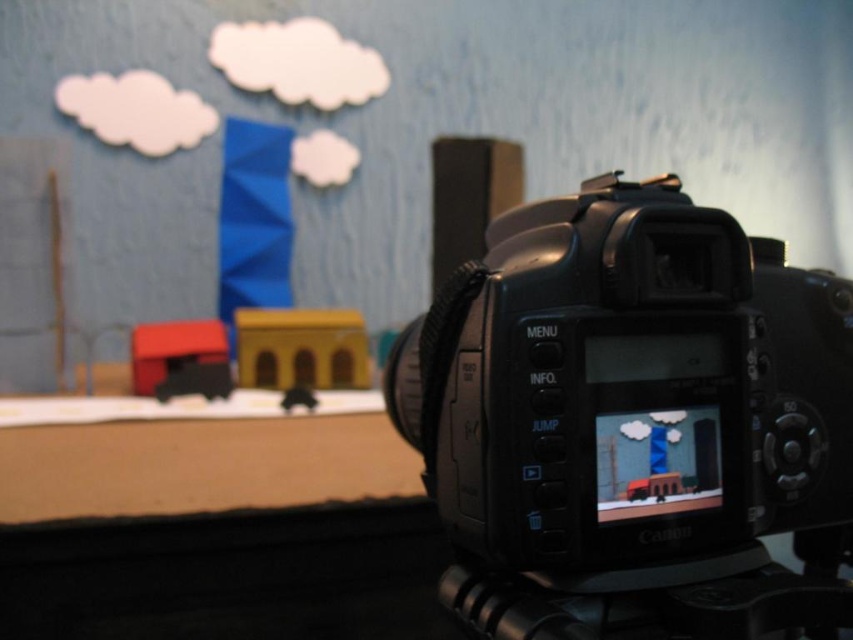
Question: Does matte paper clouds at upper center appear on the left side of black plastic camera at center?

Choices:
 (A) yes
 (B) no

Answer: (A)

Question: Does matte paper clouds at upper center have a lesser width compared to black rubber tripod at lower center?

Choices:
 (A) no
 (B) yes

Answer: (A)

Question: Which object is the closest to the black plastic camera at center?

Choices:
 (A) black rubber tripod at lower center
 (B) matte paper clouds at upper center

Answer: (A)

Question: Which object is the closest to the matte paper clouds at upper center?

Choices:
 (A) black plastic camera at center
 (B) black rubber tripod at lower center

Answer: (A)

Question: Which object appears farthest from the camera in this image?

Choices:
 (A) black plastic camera at center
 (B) black rubber tripod at lower center
 (C) matte paper clouds at upper center

Answer: (C)

Question: Does matte paper clouds at upper center come behind black plastic camera at center?

Choices:
 (A) no
 (B) yes

Answer: (B)